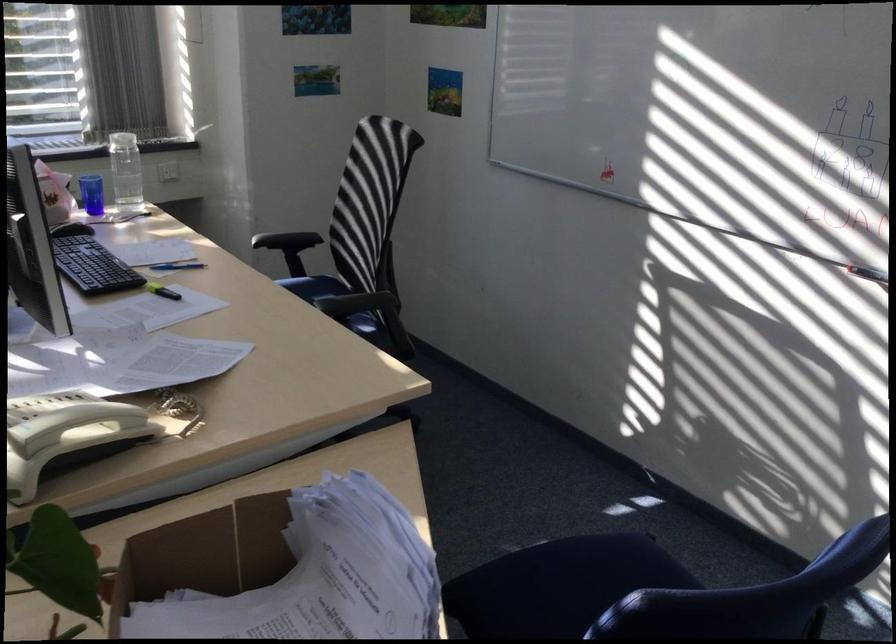
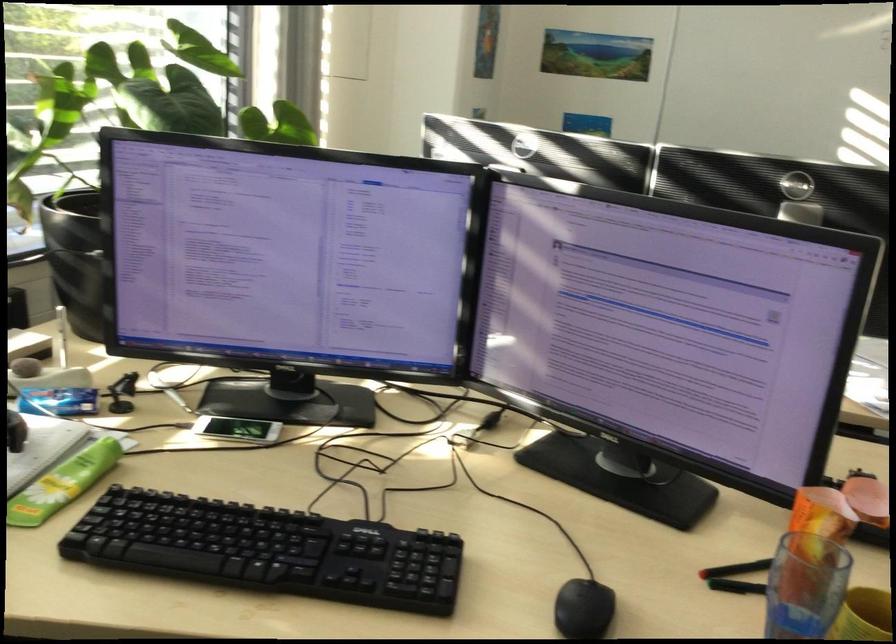
Question: I am providing you with two images of the same scene from different viewpoints. After the viewpoint changes to image2, which objects are now occluded?

Choices:
 (A) black marker
 (B) patterned sneaker
 (C) green lotion tube
 (D) yellow highlighter pen

Answer: (D)